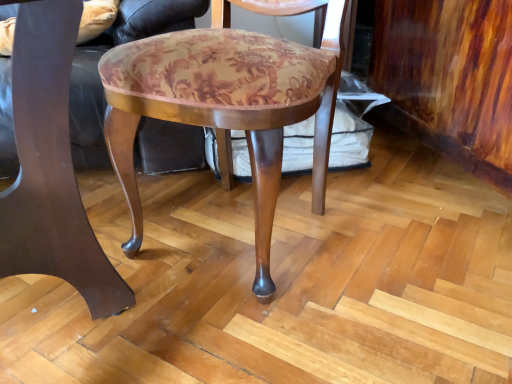
Find the location of a particular element. This screenshot has width=512, height=384. vacant space underneath wooden chair at center, marked as the second chair in a left-to-right arrangement (from a real-world perspective) is located at coordinates (230, 227).